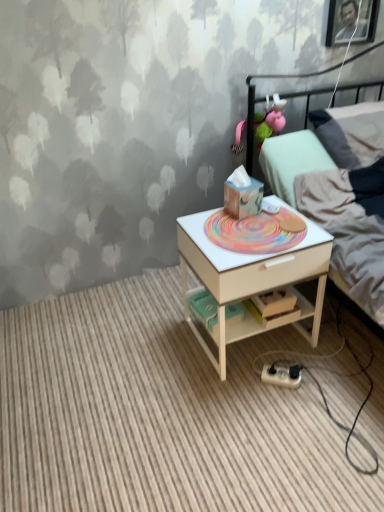
The width and height of the screenshot is (384, 512). I want to click on vacant space that is in between white wood desk at center and white plastic power strip at lower center, so click(x=284, y=372).